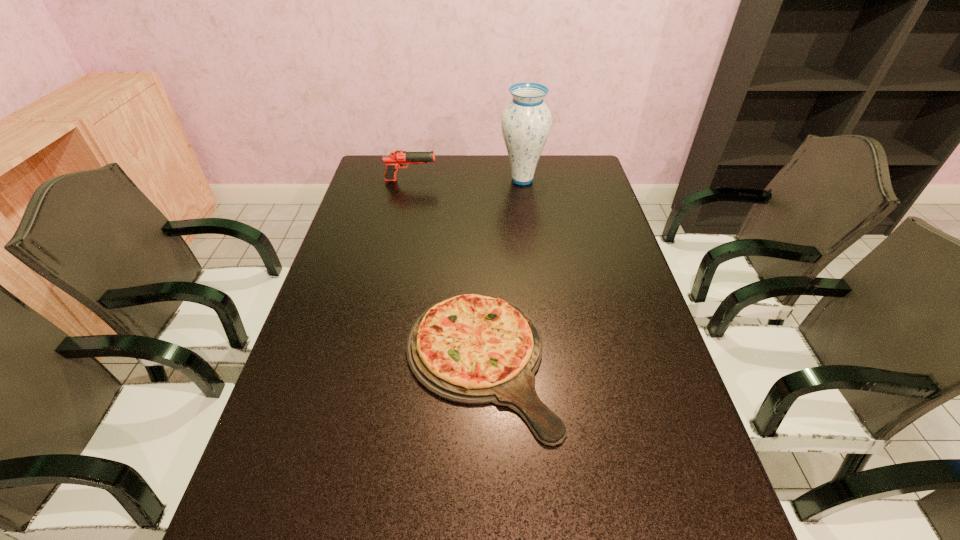
Find the location of `vacant space that satisfies the following two spatial constraints: 1. at the aiming end of the pizza; 2. on the right side of the gun`. vacant space that satisfies the following two spatial constraints: 1. at the aiming end of the pizza; 2. on the right side of the gun is located at coordinates (371, 361).

You are a GUI agent. You are given a task and a screenshot of the screen. Output one action in this format:
    pyautogui.click(x=<x>, y=<y>)
    Task: Click on the vacant area that satisfies the following two spatial constraints: 1. at the aiming end of the gun; 2. on the right side of the shortest object
    
    Given the screenshot: What is the action you would take?
    pyautogui.click(x=371, y=361)

This screenshot has height=540, width=960. In order to click on free space that satisfies the following two spatial constraints: 1. at the aiming end of the pizza; 2. on the left side of the gun in this screenshot , I will do `click(371, 361)`.

Find the location of a particular element. free spot that satisfies the following two spatial constraints: 1. at the aiming end of the gun; 2. on the right side of the shortest object is located at coordinates click(371, 361).

Locate an element on the screen. The height and width of the screenshot is (540, 960). blank area in the image that satisfies the following two spatial constraints: 1. at the aiming end of the second shortest object; 2. on the right side of the nearest object is located at coordinates (371, 361).